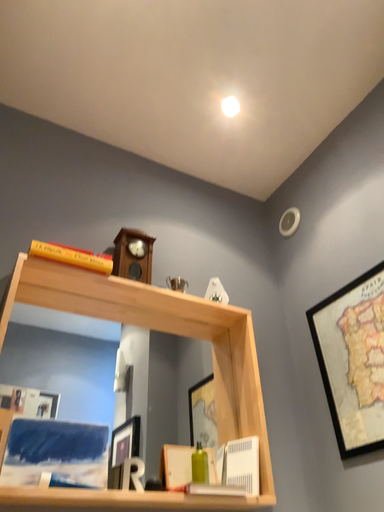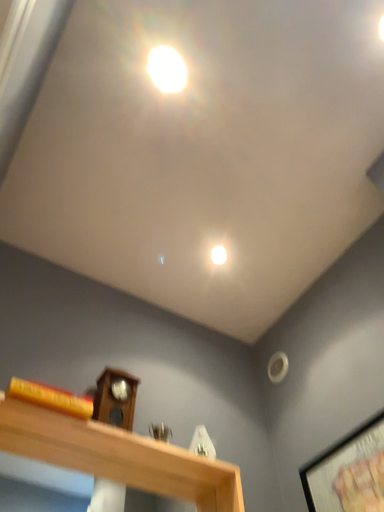
Question: How did the camera likely rotate when shooting the video?

Choices:
 (A) rotated downward
 (B) rotated upward

Answer: (B)